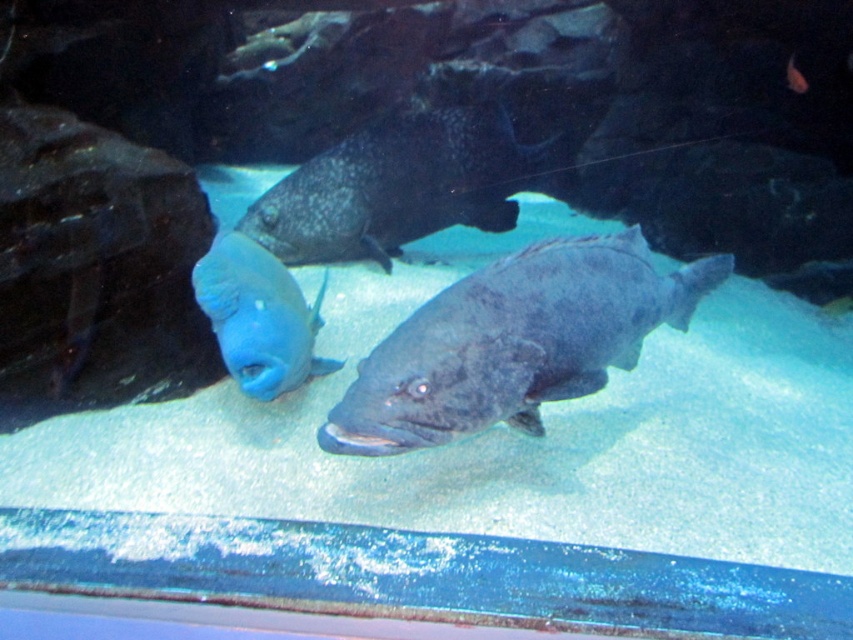
Is shiny dark gray fish at center shorter than dark gray textured fish at center?

Yes.

Is point (434, 433) less distant than point (445, 136)?

That is True.

The height and width of the screenshot is (640, 853). Find the location of `shiny dark gray fish at center`. shiny dark gray fish at center is located at coordinates (514, 342).

Which is below, dark gray textured fish at center or matte blue fish at center?

matte blue fish at center is below.

Does dark gray textured fish at center appear on the right side of matte blue fish at center?

Correct, you'll find dark gray textured fish at center to the right of matte blue fish at center.

Image resolution: width=853 pixels, height=640 pixels. I want to click on dark gray textured fish at center, so click(x=399, y=186).

Is shiny dark gray fish at center in front of matte blue fish at center?

Yes, shiny dark gray fish at center is closer to the viewer.

Image resolution: width=853 pixels, height=640 pixels. What do you see at coordinates (514, 342) in the screenshot? I see `shiny dark gray fish at center` at bounding box center [514, 342].

The width and height of the screenshot is (853, 640). What are the coordinates of `shiny dark gray fish at center` in the screenshot? It's located at click(514, 342).